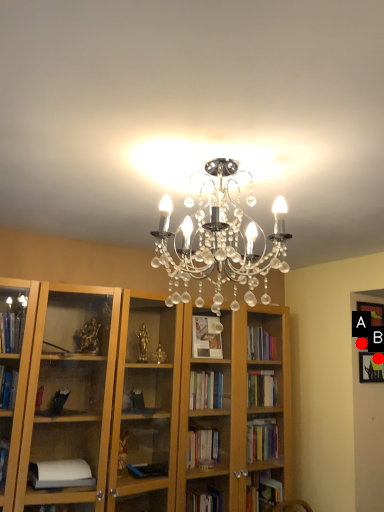
Question: Two points are circled on the image, labeled by A and B beside each circle. Which point is further to the camera?

Choices:
 (A) A is further
 (B) B is further

Answer: (A)